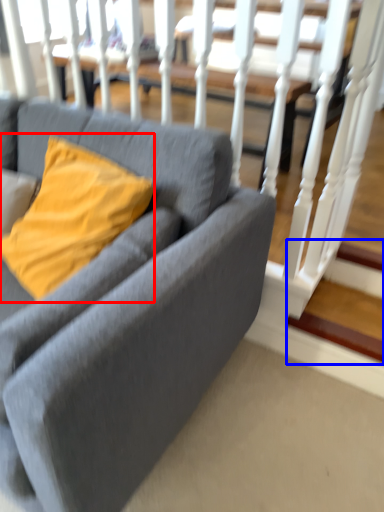
Question: Which object is further to the camera taking this photo, pillow (highlighted by a red box) or stairwell (highlighted by a blue box)?

Choices:
 (A) pillow
 (B) stairwell

Answer: (B)